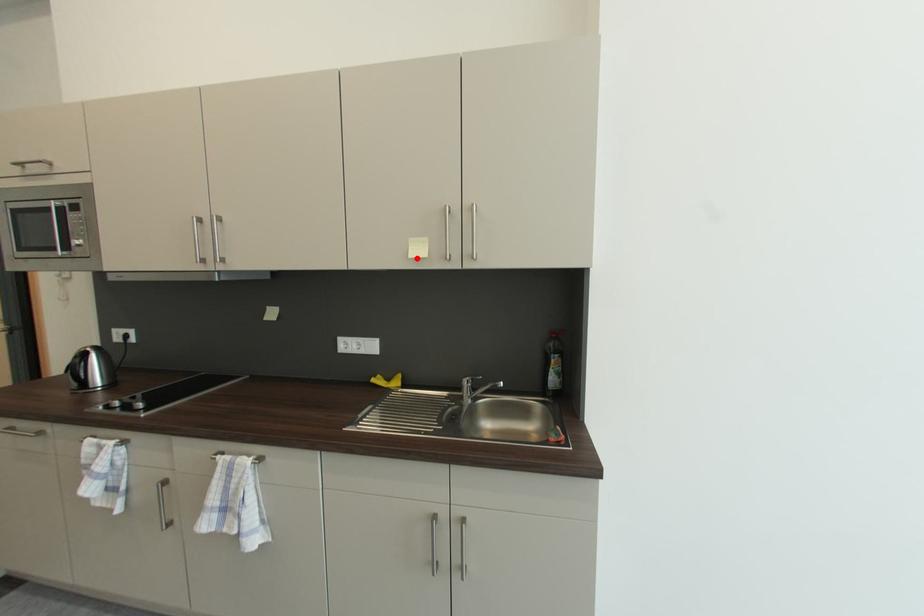
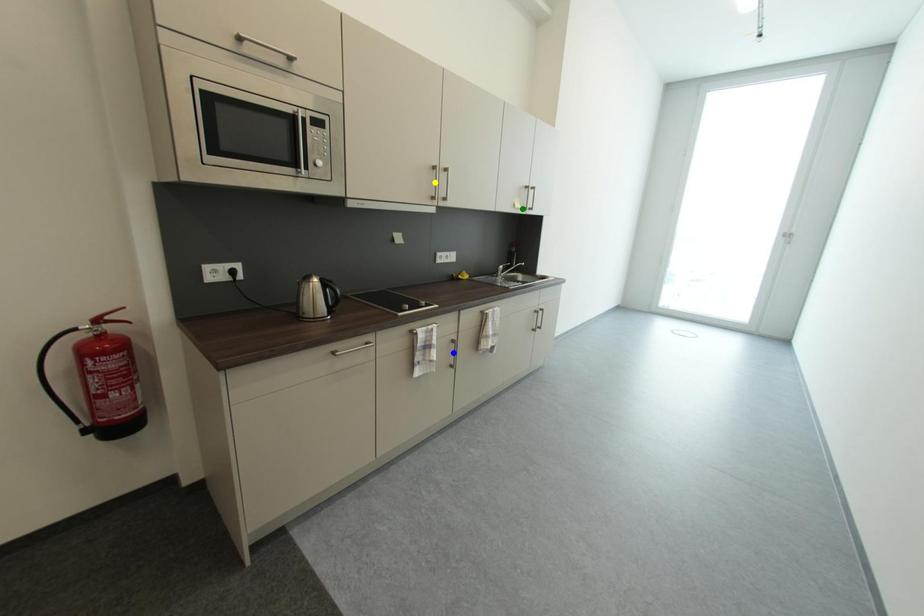
Question: I am providing you with two images of the same scene from different viewpoints. A red point is marked on the first image. You are given multiple points on the second image. In image 2, which mark is for the same physical point as the one in image 1?

Choices:
 (A) green point
 (B) yellow point
 (C) blue point

Answer: (A)